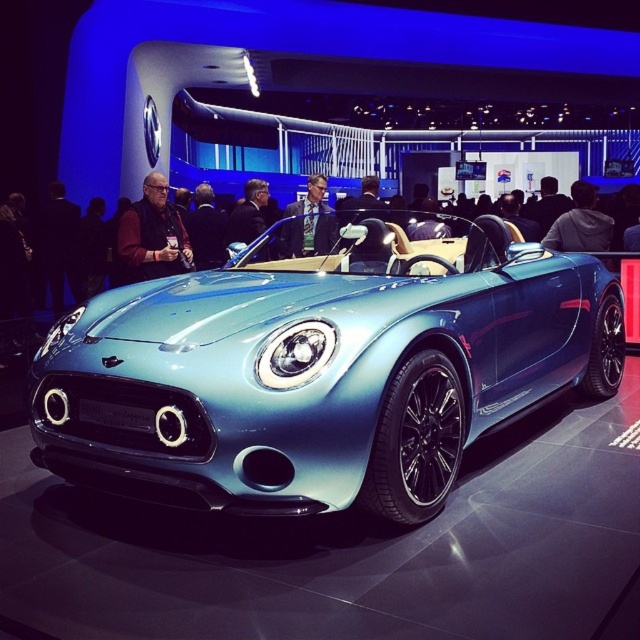
Question: Is matte black jacket at center bigger than light blue fabric suit at center?

Choices:
 (A) no
 (B) yes

Answer: (B)

Question: Based on their relative distances, which object is nearer to the metallic blue sports car at center?

Choices:
 (A) matte black jacket at center
 (B) light blue fabric suit at center

Answer: (B)

Question: Based on their relative distances, which object is nearer to the matte black jacket at center?

Choices:
 (A) metallic blue sports car at center
 (B) light blue fabric suit at center

Answer: (B)

Question: Does metallic blue sports car at center appear on the right side of light blue fabric suit at center?

Choices:
 (A) no
 (B) yes

Answer: (B)

Question: Which point is closer to the camera taking this photo?

Choices:
 (A) (317, 237)
 (B) (467, 355)
 (C) (177, 221)

Answer: (B)

Question: Can you confirm if metallic blue sports car at center is positioned below light blue fabric suit at center?

Choices:
 (A) no
 (B) yes

Answer: (B)